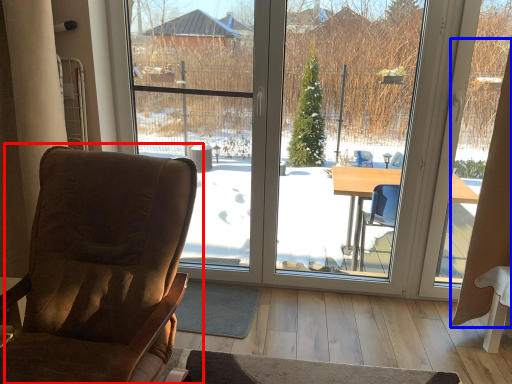
Question: Which of the following is the farthest to the observer, chair (highlighted by a red box) or curtain (highlighted by a blue box)?

Choices:
 (A) chair
 (B) curtain

Answer: (B)